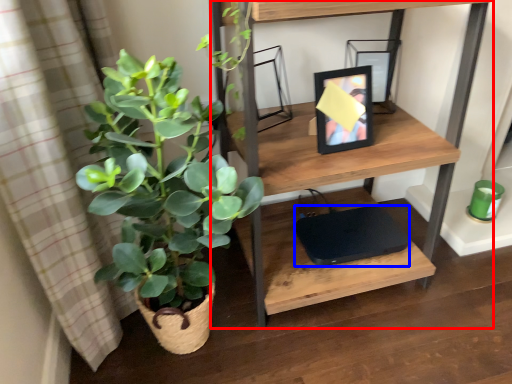
Question: Which point is further to the camera, shelf (highlighted by a red box) or computer (highlighted by a blue box)?

Choices:
 (A) shelf
 (B) computer

Answer: (B)